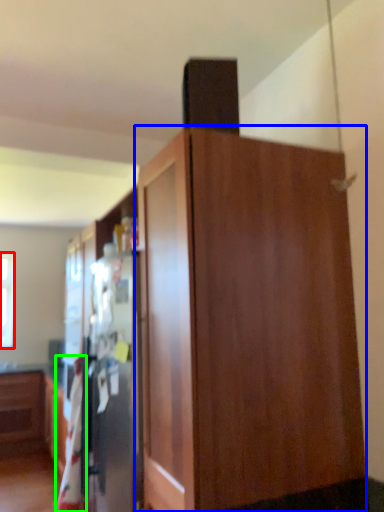
Question: Which object is positioned farthest from window (highlighted by a red box)? Select from cupboard (highlighted by a blue box) and blanket (highlighted by a green box).

Choices:
 (A) cupboard
 (B) blanket

Answer: (A)